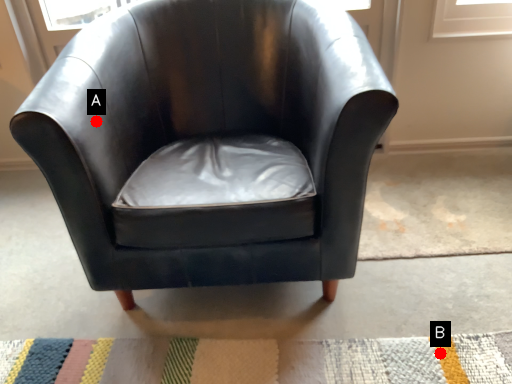
Question: Two points are circled on the image, labeled by A and B beside each circle. Which point is closer to the camera taking this photo?

Choices:
 (A) A is closer
 (B) B is closer

Answer: (A)